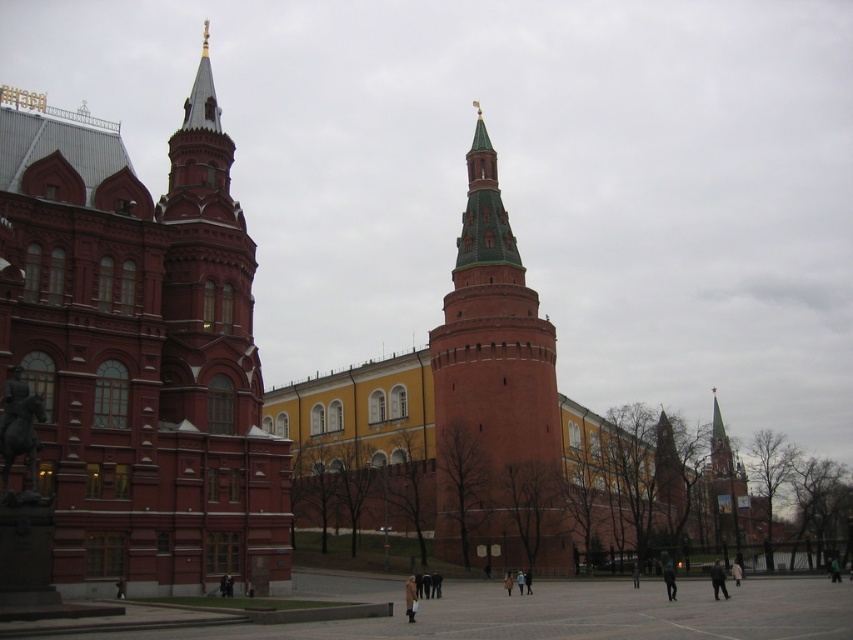
Is smooth brick tower at center wider than brick tower at center?

Correct, the width of smooth brick tower at center exceeds that of brick tower at center.

Based on the photo, who is higher up, smooth brick tower at center or brick tower at center?

brick tower at center is above.

The width and height of the screenshot is (853, 640). What do you see at coordinates (503, 428) in the screenshot?
I see `smooth brick tower at center` at bounding box center [503, 428].

Locate an element on the screen. This screenshot has height=640, width=853. smooth brick tower at center is located at coordinates (503, 428).

The width and height of the screenshot is (853, 640). In order to click on smooth brick church at left in this screenshot , I will do click(138, 353).

Can you confirm if smooth brick church at left is thinner than brick tower at center?

No, smooth brick church at left is not thinner than brick tower at center.

Is point (158, 588) farther from camera compared to point (456, 388)?

No, it is not.

The width and height of the screenshot is (853, 640). In order to click on smooth brick church at left in this screenshot , I will do `click(138, 353)`.

Between point (20, 337) and point (459, 449), which one is positioned behind?

Point (459, 449)

Does smooth brick church at left have a lesser width compared to smooth brick tower at center?

Correct, smooth brick church at left's width is less than smooth brick tower at center's.

Does point (67, 273) lie in front of point (439, 531)?

Yes.

The width and height of the screenshot is (853, 640). What are the coordinates of `smooth brick church at left` in the screenshot? It's located at (138, 353).